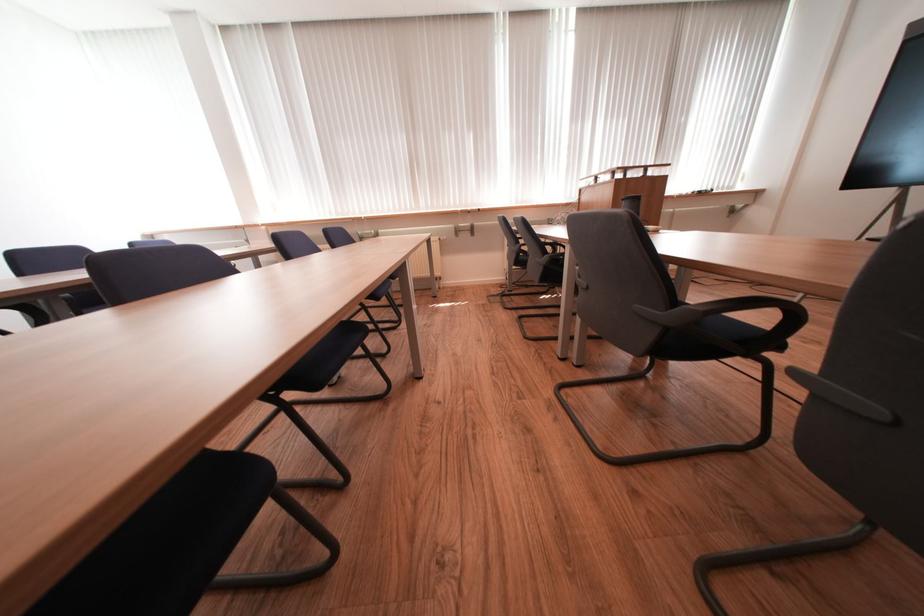
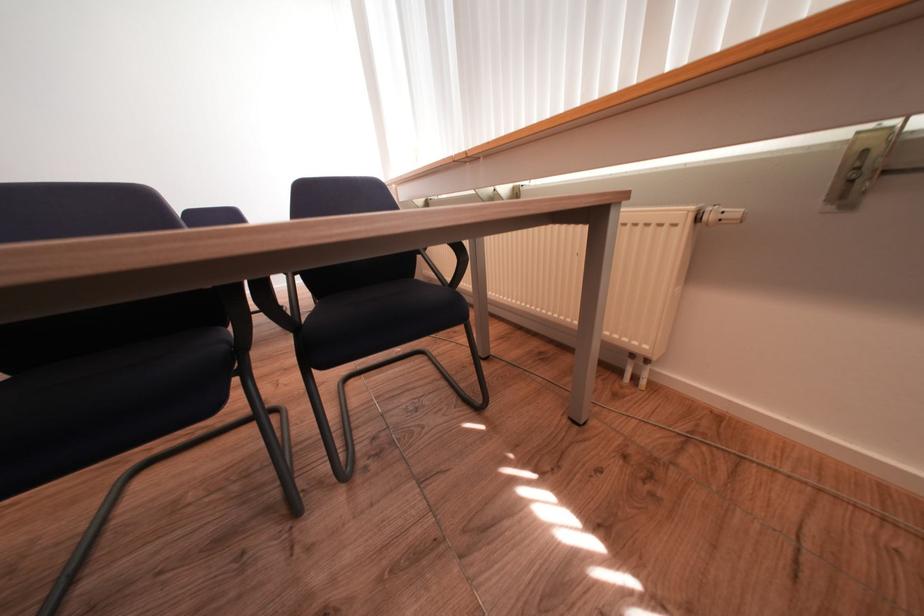
In the second image, find the point that corresponds to point (454, 238) in the first image.

(745, 215)